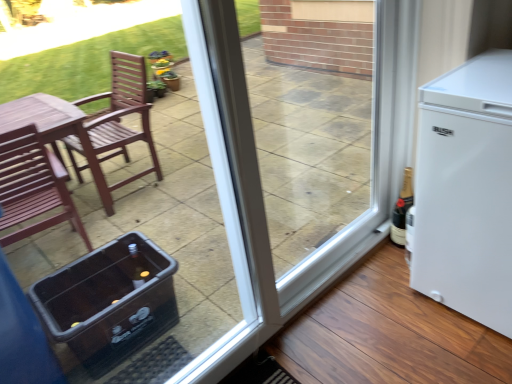
Question: Is transparent glass screen door at center taller than black glass bottle at right?

Choices:
 (A) yes
 (B) no

Answer: (A)

Question: From the image's perspective, is transparent glass screen door at center on top of black glass bottle at right?

Choices:
 (A) yes
 (B) no

Answer: (A)

Question: Is transparent glass screen door at center looking in the opposite direction of black glass bottle at right?

Choices:
 (A) yes
 (B) no

Answer: (A)

Question: Is transparent glass screen door at center smaller than black glass bottle at right?

Choices:
 (A) no
 (B) yes

Answer: (A)

Question: Is transparent glass screen door at center touching black glass bottle at right?

Choices:
 (A) yes
 (B) no

Answer: (B)

Question: Would you say white matte refrigerator at right is inside or outside transparent plastic cooler at lower left?

Choices:
 (A) outside
 (B) inside

Answer: (A)

Question: Considering their positions, is white matte refrigerator at right located in front of or behind transparent plastic cooler at lower left?

Choices:
 (A) behind
 (B) front

Answer: (A)

Question: Is point (458, 291) closer or farther from the camera than point (38, 278)?

Choices:
 (A) farther
 (B) closer

Answer: (B)

Question: Is white matte refrigerator at right taller or shorter than transparent plastic cooler at lower left?

Choices:
 (A) short
 (B) tall

Answer: (A)

Question: Considering the positions of black glass bottle at right and white matte refrigerator at right in the image, is black glass bottle at right taller or shorter than white matte refrigerator at right?

Choices:
 (A) tall
 (B) short

Answer: (B)

Question: Is black glass bottle at right wider or thinner than white matte refrigerator at right?

Choices:
 (A) wide
 (B) thin

Answer: (B)

Question: Considering the positions of point (398, 210) and point (433, 236), is point (398, 210) closer or farther from the camera than point (433, 236)?

Choices:
 (A) farther
 (B) closer

Answer: (A)

Question: From a real-world perspective, is black glass bottle at right above or below white matte refrigerator at right?

Choices:
 (A) below
 (B) above

Answer: (A)

Question: Is transparent plastic cooler at lower left wider or thinner than black glass bottle at right?

Choices:
 (A) wide
 (B) thin

Answer: (A)

Question: Considering their positions, is transparent plastic cooler at lower left located in front of or behind black glass bottle at right?

Choices:
 (A) front
 (B) behind

Answer: (A)